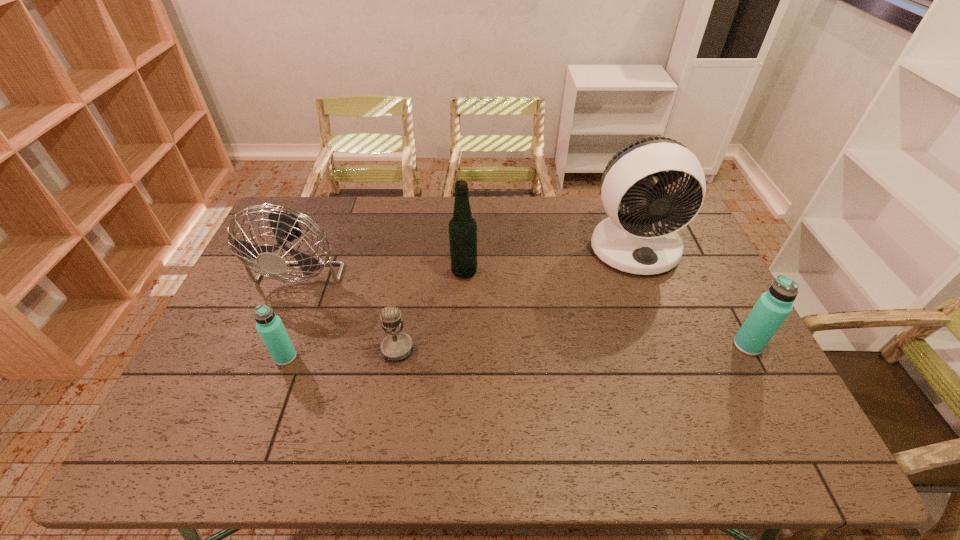
The height and width of the screenshot is (540, 960). Find the location of `free space between the rightmost object and the left fan`. free space between the rightmost object and the left fan is located at coordinates (527, 302).

The height and width of the screenshot is (540, 960). What are the coordinates of `free space between the alcohol and the taller thermos bottle` in the screenshot? It's located at (606, 308).

At what (x,y) coordinates should I click in order to perform the action: click on unoccupied position between the fifth object from left to right and the left thermos bottle. Please return your answer as a coordinate pair (x, y). The image size is (960, 540). Looking at the image, I should click on (460, 302).

Where is `free space between the shorter thermos bottle and the taller fan`? Image resolution: width=960 pixels, height=540 pixels. free space between the shorter thermos bottle and the taller fan is located at coordinates (460, 302).

You are a GUI agent. You are given a task and a screenshot of the screen. Output one action in this format:
    pyautogui.click(x=<x>, y=<y>)
    Task: Click on the vacant area that lies between the shorter thermos bottle and the right fan
    
    Given the screenshot: What is the action you would take?
    pyautogui.click(x=460, y=302)

You are a GUI agent. You are given a task and a screenshot of the screen. Output one action in this format:
    pyautogui.click(x=<x>, y=<y>)
    Task: Click on the free space between the fourth tallest object and the taller fan
    This screenshot has width=960, height=540.
    Given the screenshot: What is the action you would take?
    pyautogui.click(x=690, y=296)

Identify the location of object that is the third closest to the fourth object from left to right. (646, 242).

Identify which object is the third nearest to the alcohol. Please provide its 2D coordinates. Your answer should be formatted as a tuple, i.e. [(x, y)], where the tuple contains the x and y coordinates of a point satisfying the conditions above.

[(646, 242)]

The height and width of the screenshot is (540, 960). Find the location of `vacant space that satisfies the following two spatial constraints: 1. on the front-facing side of the fourth tallest object; 2. on the right side of the left fan`. vacant space that satisfies the following two spatial constraints: 1. on the front-facing side of the fourth tallest object; 2. on the right side of the left fan is located at coordinates (272, 345).

Where is `vacant region that satisfies the following two spatial constraints: 1. on the front-facing side of the right thermos bottle; 2. on the right side of the left fan`? The width and height of the screenshot is (960, 540). vacant region that satisfies the following two spatial constraints: 1. on the front-facing side of the right thermos bottle; 2. on the right side of the left fan is located at coordinates (272, 345).